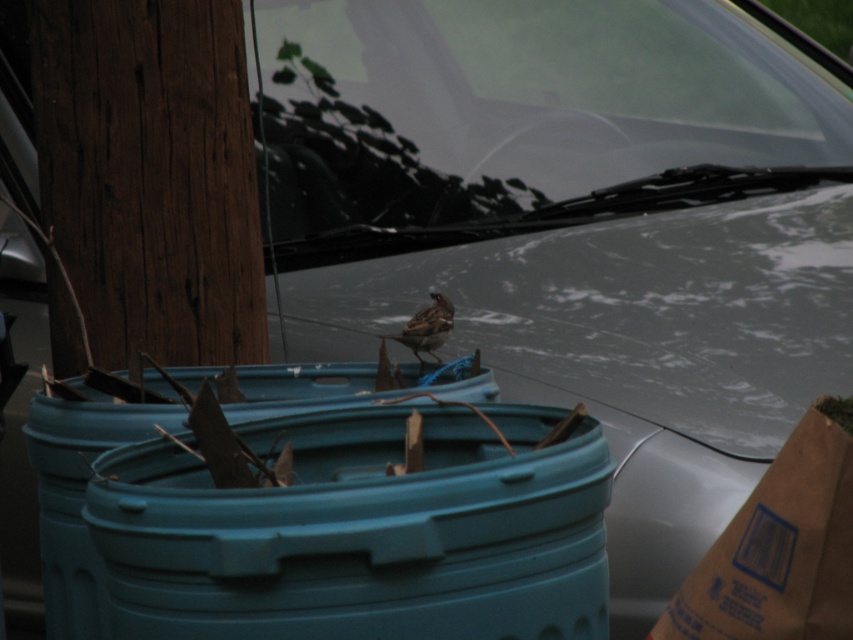
You are a delivery person trying to place a brown paper bag at upper right on the ground near the containers. However, you notice the brown speckled sparrow at center is sitting where you want to put it. Can you place the bag there without disturbing the bird?

The brown paper bag at upper right is located below the brown speckled sparrow at center, so placing the bag where the sparrow is sitting would require moving the bird. Since the sparrow is at the center and the bag is below it, you might need to adjust the placement to avoid disturbing the bird.

You are a delivery drone that needs to fly through the clear glass windshield at upper center to deliver a package. What are the exact coordinates where you should aim to pass through?

The clear glass windshield at upper center is located at coordinates point (521, 116).

In the scene shown: You are a delivery person trying to place a brown paper bag at upper right on the ground near the brown speckled sparrow at center. Can you place the bag directly in front of the sparrow without moving the sparrow?

The brown paper bag at upper right is already in front of the brown speckled sparrow at center, so placing it directly in front would require moving it further forward, but since the sparrow is already behind the bag, it is already positioned correctly.